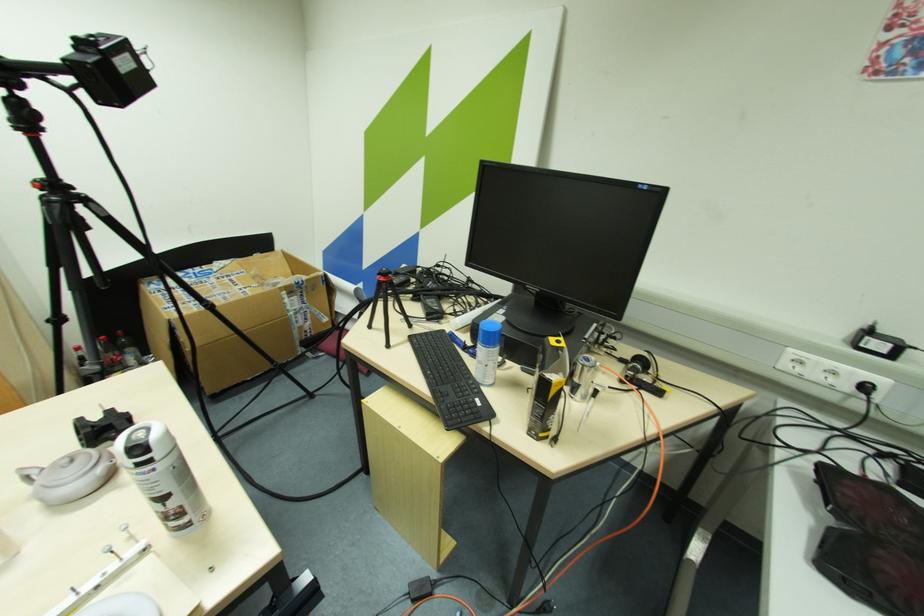
The height and width of the screenshot is (616, 924). Find the location of `black power adapter`. black power adapter is located at coordinates (432, 597).